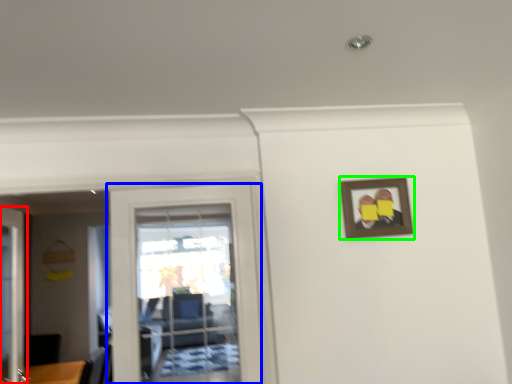
Question: Estimate the real-world distances between objects in this image. Which object is farther from door (highlighted by a red box), door (highlighted by a blue box) or picture frame (highlighted by a green box)?

Choices:
 (A) door
 (B) picture frame

Answer: (B)